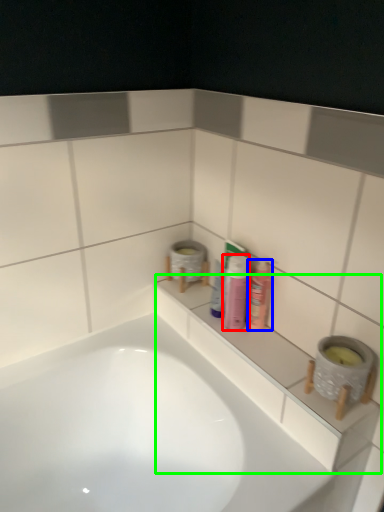
Question: Which is nearer to the toiletry (highlighted by a red box)? mouthwash (highlighted by a blue box) or ledge (highlighted by a green box).

Choices:
 (A) mouthwash
 (B) ledge

Answer: (A)